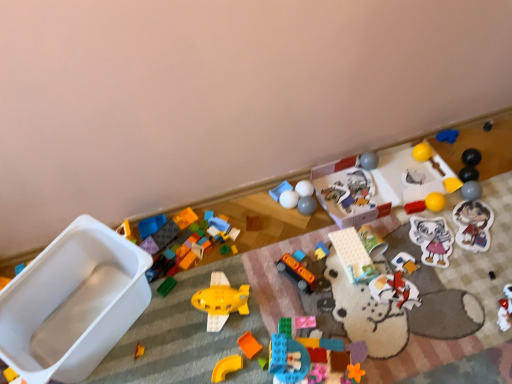
Where is `free space that is in between rubber duck at center, which ranks as the eleventh toy in right-to-left order, and pink matte block at center, acting as the 14th toy starting from the right`? The height and width of the screenshot is (384, 512). free space that is in between rubber duck at center, which ranks as the eleventh toy in right-to-left order, and pink matte block at center, acting as the 14th toy starting from the right is located at coordinates (315, 294).